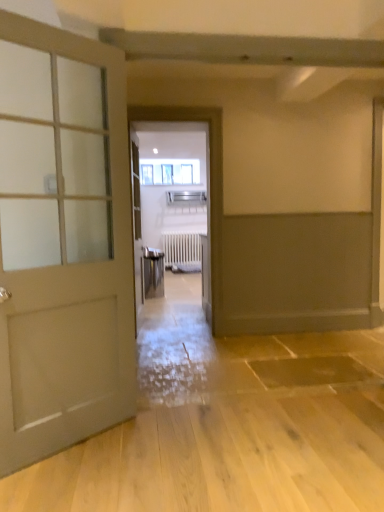
What do you see at coordinates (170, 172) in the screenshot?
I see `clear glass window at center` at bounding box center [170, 172].

Looking at this image, what is the approximate width of metallic elevator at center?

metallic elevator at center is 4.42 inches in width.

Where is `clear glass window at center`? The image size is (384, 512). clear glass window at center is located at coordinates (170, 172).

Between metallic elevator at center and matte white door at left, which one appears on the left side from the viewer's perspective?

matte white door at left is more to the left.

Based on their sizes in the image, would you say metallic elevator at center is bigger or smaller than matte white door at left?

In the image, metallic elevator at center appears to be larger than matte white door at left.

Which is in front, point (219, 224) or point (68, 425)?

The point (68, 425) is in front.

Considering the relative sizes of metallic elevator at center and clear glass window at center in the image provided, is metallic elevator at center thinner than clear glass window at center?

No, metallic elevator at center is not thinner than clear glass window at center.

Is clear glass window at center inside metallic elevator at center?

No.

Based on their sizes in the image, would you say metallic elevator at center is bigger or smaller than clear glass window at center?

In the image, metallic elevator at center appears to be larger than clear glass window at center.

Is metallic elevator at center touching clear glass window at center?

metallic elevator at center and clear glass window at center are not in contact.

Is clear glass window at center oriented towards metallic elevator at center?

Yes, clear glass window at center faces towards metallic elevator at center.

Considering the sizes of objects clear glass window at center and metallic elevator at center in the image provided, who is taller, clear glass window at center or metallic elevator at center?

With more height is metallic elevator at center.

Considering the sizes of objects white matte radiator at center and metallic elevator at center in the image provided, who is shorter, white matte radiator at center or metallic elevator at center?

With less height is white matte radiator at center.

Which of these two, white matte radiator at center or metallic elevator at center, is smaller?

white matte radiator at center is smaller.

From a real-world perspective, between white matte radiator at center and metallic elevator at center, who is vertically lower?

From a 3D spatial view, white matte radiator at center is below.

Is white matte radiator at center thinner than metallic elevator at center?

Correct, the width of white matte radiator at center is less than that of metallic elevator at center.

Would you say matte white door at left is inside or outside metallic elevator at center?

matte white door at left exists outside the volume of metallic elevator at center.

Consider the image. Can you confirm if matte white door at left is taller than metallic elevator at center?

No, matte white door at left is not taller than metallic elevator at center.

Which is in front, point (27, 214) or point (208, 111)?

The point (27, 214) is in front.

I want to click on door below the metallic elevator at center (from a real-world perspective), so click(62, 241).

From a real-world perspective, between white matte radiator at center and clear glass window at center, who is vertically lower?

In real-world perspective, white matte radiator at center is lower.

Is white matte radiator at center at the right side of clear glass window at center?

Indeed, white matte radiator at center is positioned on the right side of clear glass window at center.

Considering the relative sizes of white matte radiator at center and clear glass window at center in the image provided, is white matte radiator at center wider than clear glass window at center?

No, white matte radiator at center is not wider than clear glass window at center.

How distant is white matte radiator at center from clear glass window at center?

white matte radiator at center and clear glass window at center are 1.13 meters apart.

Considering the sizes of objects matte white door at left and clear glass window at center in the image provided, who is shorter, matte white door at left or clear glass window at center?

With less height is clear glass window at center.

Find the location of a particular element. window above the matte white door at left (from a real-world perspective) is located at coordinates (170, 172).

Which is more to the left, matte white door at left or clear glass window at center?

From the viewer's perspective, matte white door at left appears more on the left side.

From a real-world perspective, is matte white door at left on clear glass window at center?

No, from a real-world perspective, matte white door at left is not above clear glass window at center.

This screenshot has height=512, width=384. I want to click on elevator that is above the matte white door at left (from the image's perspective), so click(x=209, y=179).

The image size is (384, 512). In order to click on window located on the left of metallic elevator at center in this screenshot , I will do `click(170, 172)`.

Estimate the real-world distances between objects in this image. Which object is further from matte white door at left, white matte radiator at center or clear glass window at center?

clear glass window at center.

Estimate the real-world distances between objects in this image. Which object is closer to matte white door at left, metallic elevator at center or clear glass window at center?

metallic elevator at center is closer to matte white door at left.

Looking at the image, which one is located further to metallic elevator at center, white matte radiator at center or clear glass window at center?

Based on the image, clear glass window at center appears to be further to metallic elevator at center.

Which object lies nearer to the anchor point clear glass window at center, metallic elevator at center or matte white door at left?

Among the two, metallic elevator at center is located nearer to clear glass window at center.

Consider the image. Based on their spatial positions, is matte white door at left or clear glass window at center further from white matte radiator at center?

matte white door at left lies further to white matte radiator at center than the other object.

Looking at the image, which one is located further to matte white door at left, clear glass window at center or white matte radiator at center?

clear glass window at center is positioned further to the anchor matte white door at left.

Which object lies nearer to the anchor point metallic elevator at center, clear glass window at center or white matte radiator at center?

The object closer to metallic elevator at center is white matte radiator at center.

Estimate the real-world distances between objects in this image. Which object is closer to clear glass window at center, matte white door at left or white matte radiator at center?

Based on the image, white matte radiator at center appears to be nearer to clear glass window at center.

Image resolution: width=384 pixels, height=512 pixels. I want to click on window between matte white door at left and white matte radiator at center in the front-back direction, so click(170, 172).

Find the location of a particular element. window between metallic elevator at center and white matte radiator at center from front to back is located at coordinates (170, 172).

At what (x,y) coordinates should I click in order to perform the action: click on elevator between matte white door at left and white matte radiator at center along the z-axis. Please return your answer as a coordinate pair (x, y). Looking at the image, I should click on (209, 179).

Locate an element on the screen. The height and width of the screenshot is (512, 384). elevator positioned between matte white door at left and clear glass window at center from near to far is located at coordinates (209, 179).